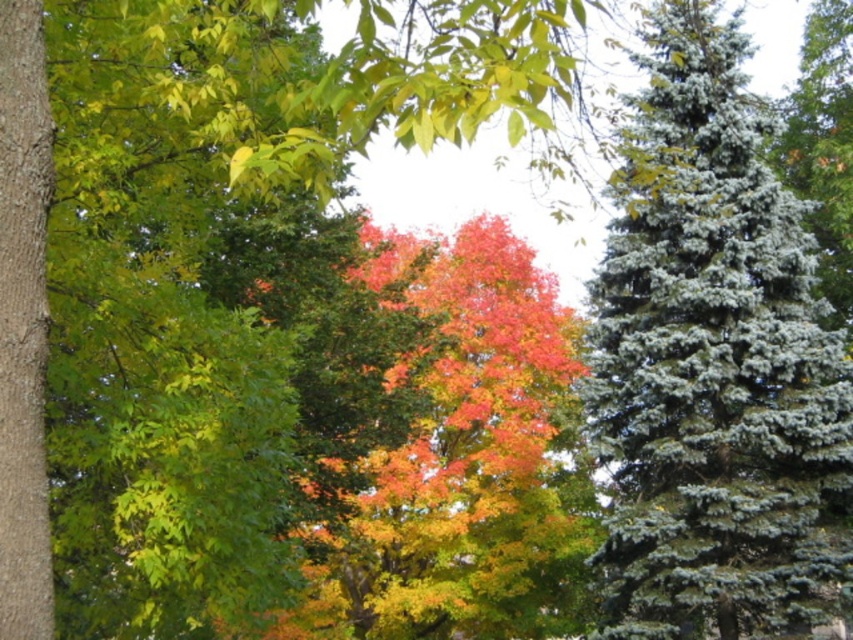
Question: Among these points, which one is farthest from the camera?

Choices:
 (A) (33, 556)
 (B) (548, 358)
 (C) (634, 588)

Answer: (B)

Question: Among these points, which one is farthest from the camera?

Choices:
 (A) click(26, 436)
 (B) click(318, 435)

Answer: (B)

Question: Can you confirm if blue-green needle-like at right is positioned above vivid orange leaves at center?

Choices:
 (A) yes
 (B) no

Answer: (A)

Question: In this image, where is blue-green needle-like at right located relative to smooth brown bark at left?

Choices:
 (A) above
 (B) below

Answer: (A)

Question: Is blue-green needle-like at right wider than smooth brown bark at left?

Choices:
 (A) no
 (B) yes

Answer: (B)

Question: Which of these objects is positioned farthest from the smooth brown bark at left?

Choices:
 (A) vivid orange leaves at center
 (B) blue-green needle-like at right

Answer: (A)